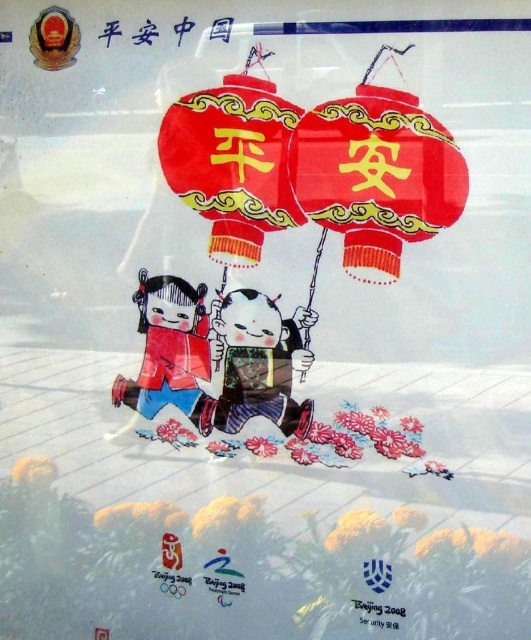
Question: Where is red glossy paper lantern at center located in relation to black paper at lower right in the image?

Choices:
 (A) below
 (B) above

Answer: (B)

Question: Which point is closer to the camera?

Choices:
 (A) (383, 604)
 (B) (228, 145)
 (C) (432, 141)
 (D) (299, 432)

Answer: (C)

Question: Which point is farther from the camera taking this photo?

Choices:
 (A) [x=391, y=621]
 (B) [x=353, y=216]
 (C) [x=290, y=108]

Answer: (B)

Question: Which point appears closest to the camera in this image?

Choices:
 (A) (165, 333)
 (B) (252, 381)

Answer: (B)

Question: Is silky fabric geisha at center closer to camera compared to black paper at lower right?

Choices:
 (A) no
 (B) yes

Answer: (A)

Question: Is silky fabric geisha at center to the left of matte red paper doll at lower left from the viewer's perspective?

Choices:
 (A) yes
 (B) no

Answer: (B)